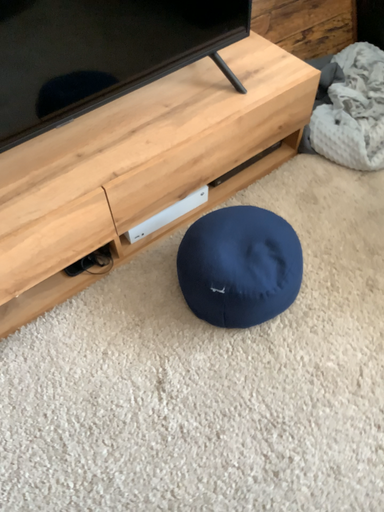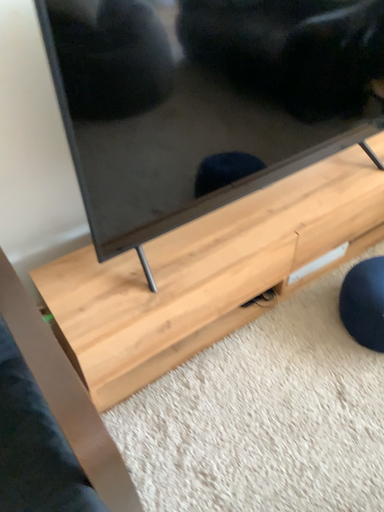
Question: Which way did the camera rotate in the video?

Choices:
 (A) rotated downward
 (B) rotated upward

Answer: (B)